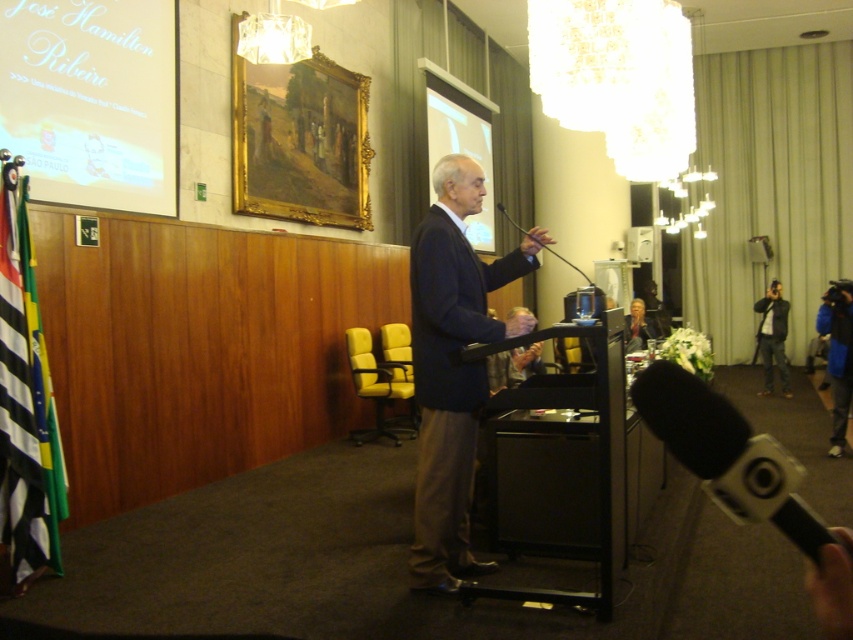
Does point (793, 531) come in front of point (508, 220)?

Yes, point (793, 531) is in front of point (508, 220).

From the picture: Which is above, black plastic microphone at lower right or black matte microphone at center?

black matte microphone at center is higher up.

Describe the element at coordinates (728, 454) in the screenshot. This screenshot has width=853, height=640. I see `black plastic microphone at lower right` at that location.

This screenshot has height=640, width=853. I want to click on black plastic microphone at lower right, so click(x=728, y=454).

Locate an element on the screen. The image size is (853, 640). gray fabric camera at right is located at coordinates pos(772,337).

Can you confirm if gray fabric camera at right is thinner than black matte microphone at center?

Indeed, gray fabric camera at right has a lesser width compared to black matte microphone at center.

Is point (772, 305) positioned behind point (518, 225)?

No.

The image size is (853, 640). What are the coordinates of `gray fabric camera at right` in the screenshot? It's located at [x=772, y=337].

Who is taller, dark blue suit at center or gray fabric camera at right?

dark blue suit at center is taller.

Does point (425, 440) come in front of point (762, 304)?

Yes, it is.

Where is `dark blue suit at center`? dark blue suit at center is located at coordinates (451, 368).